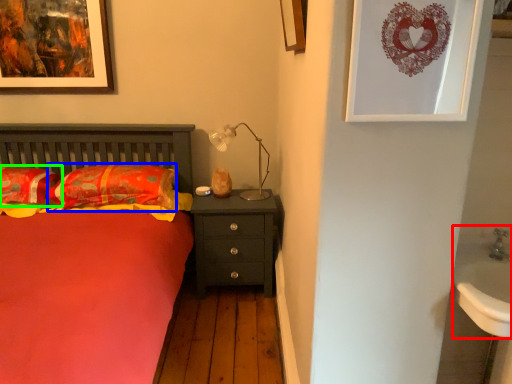
Question: Considering the real-world distances, which object is closest to sink (highlighted by a red box)? pillow (highlighted by a blue box) or pillow (highlighted by a green box).

Choices:
 (A) pillow
 (B) pillow

Answer: (A)